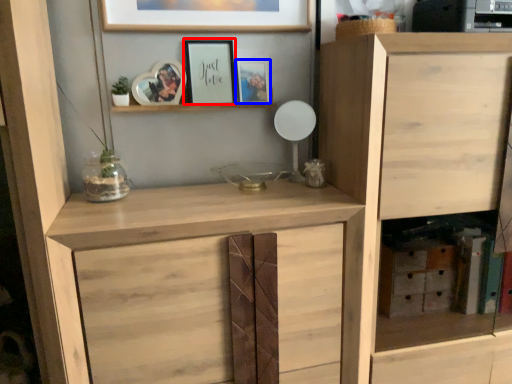
Question: Which object appears farthest to the camera in this image, picture frame (highlighted by a red box) or picture frame (highlighted by a blue box)?

Choices:
 (A) picture frame
 (B) picture frame

Answer: (B)